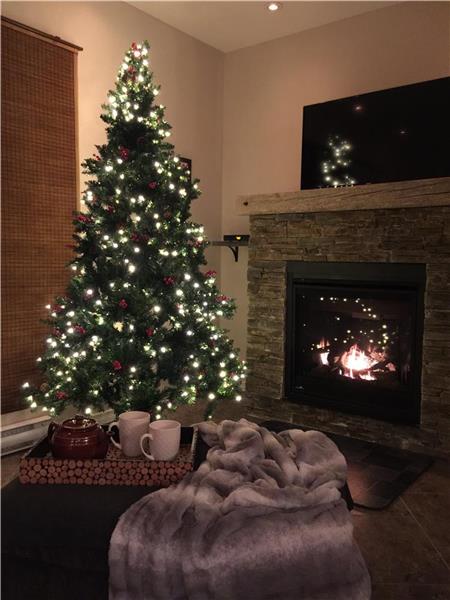
Where is `mug`? This screenshot has height=600, width=450. mug is located at coordinates (156, 443).